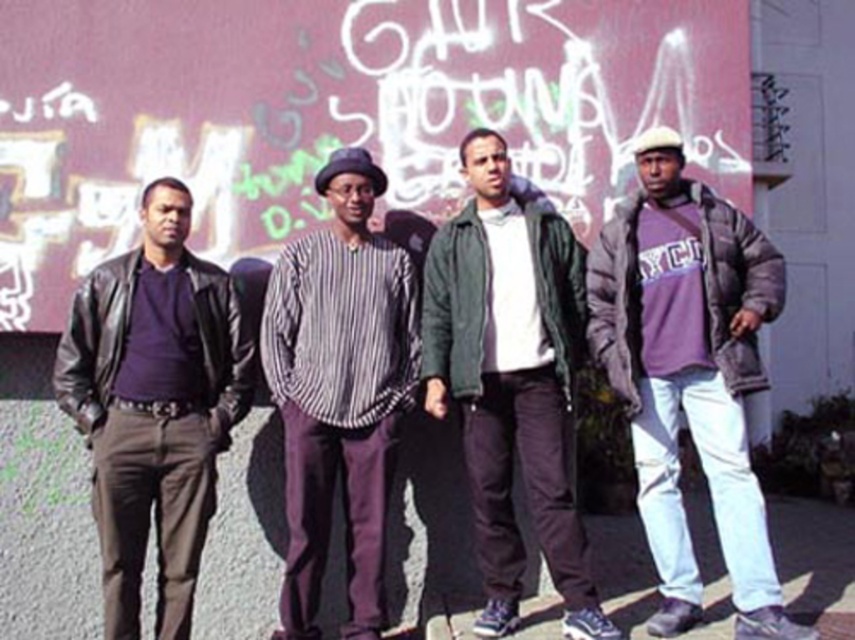
Question: Does purple fleece jacket at right appear under green matte jacket at center?

Choices:
 (A) no
 (B) yes

Answer: (A)

Question: Which object is closer to the camera taking this photo?

Choices:
 (A) striped cotton shirt at center
 (B) purple fleece jacket at right
 (C) matte black jacket at left
 (D) green matte jacket at center

Answer: (B)

Question: Which object appears closest to the camera in this image?

Choices:
 (A) striped cotton shirt at center
 (B) matte black jacket at left

Answer: (B)

Question: From the image, what is the correct spatial relationship of purple fleece jacket at right in relation to green matte jacket at center?

Choices:
 (A) right
 (B) left

Answer: (A)

Question: Which is nearer to the matte black jacket at left?

Choices:
 (A) purple fleece jacket at right
 (B) green matte jacket at center

Answer: (B)

Question: Can you confirm if purple fleece jacket at right is bigger than green matte jacket at center?

Choices:
 (A) yes
 (B) no

Answer: (A)